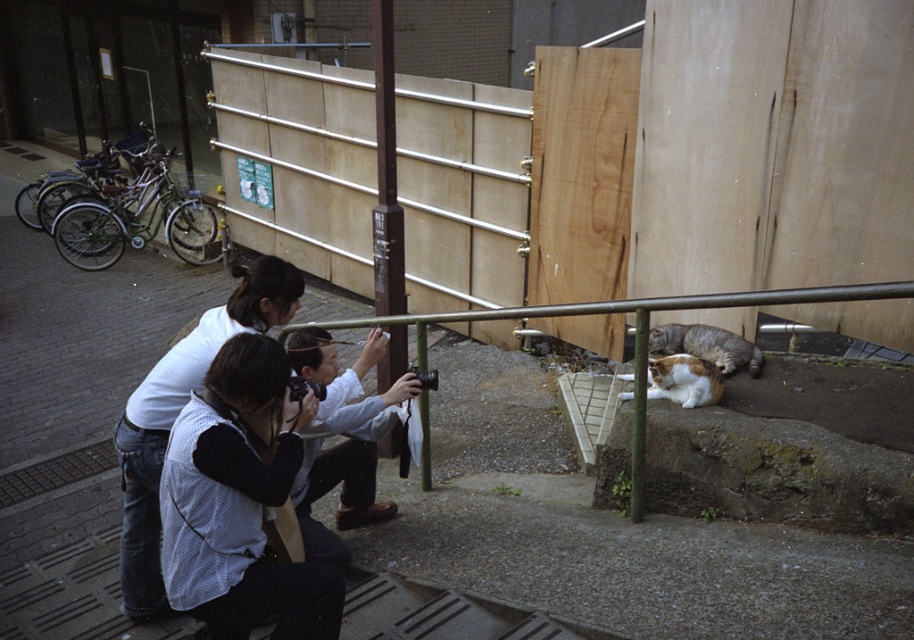
How distant is gray tabby cat at lower right from orange and white fur cat at lower right?

gray tabby cat at lower right is 37.53 centimeters from orange and white fur cat at lower right.

In the scene shown: Does gray tabby cat at lower right have a greater width compared to orange and white fur cat at lower right?

Indeed, gray tabby cat at lower right has a greater width compared to orange and white fur cat at lower right.

Is point (659, 344) farther from viewer compared to point (689, 376)?

Yes.

Where is `gray tabby cat at lower right`? The image size is (914, 640). gray tabby cat at lower right is located at coordinates (707, 346).

Who is lower down, white shirt at lower left or white cotton shirt at center?

Positioned lower is white cotton shirt at center.

Is white shirt at lower left smaller than white cotton shirt at center?

Incorrect, white shirt at lower left is not smaller in size than white cotton shirt at center.

Does point (162, 364) lie behind point (320, 344)?

No, (162, 364) is closer to viewer.

Identify the location of white shirt at lower left. (178, 413).

Which is below, white shirt at lower left or gray tabby cat at lower right?

white shirt at lower left is lower down.

Can you confirm if white shirt at lower left is wider than gray tabby cat at lower right?

Yes, white shirt at lower left is wider than gray tabby cat at lower right.

Which is behind, point (211, 348) or point (711, 342)?

The point (711, 342) is more distant.

Where is `white shirt at lower left`? white shirt at lower left is located at coordinates (178, 413).